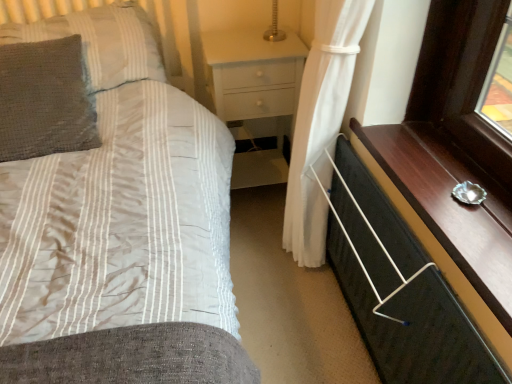
The image size is (512, 384). What are the coordinates of `vacant region to the left of white fabric curtain at lower right` in the screenshot? It's located at (261, 281).